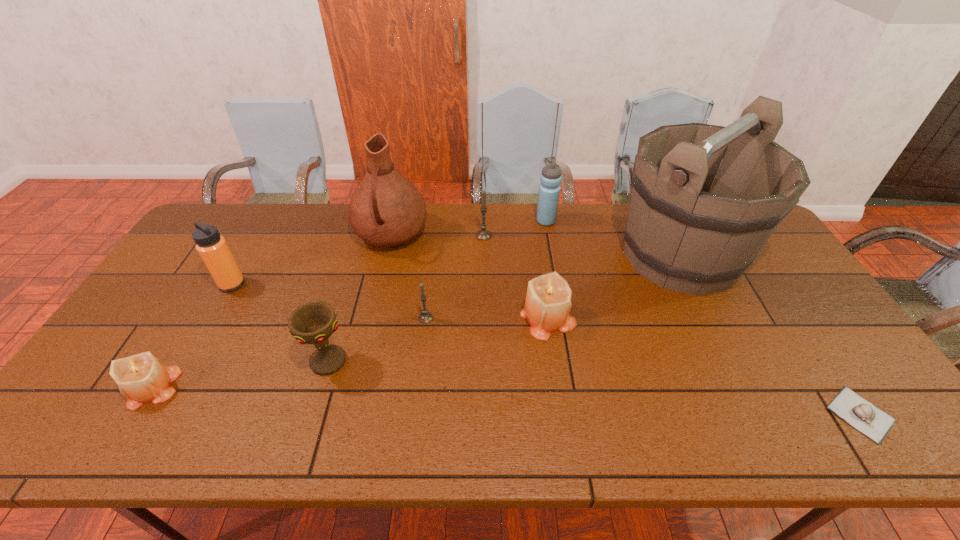
The image size is (960, 540). I want to click on the nearer gray candle, so click(425, 317).

You are a GUI agent. You are given a task and a screenshot of the screen. Output one action in this format:
    pyautogui.click(x=<x>, y=<y>)
    Task: Click on the left beige candle
    The height and width of the screenshot is (540, 960).
    Given the screenshot: What is the action you would take?
    pyautogui.click(x=142, y=378)

Image resolution: width=960 pixels, height=540 pixels. I want to click on the nearer beige candle, so click(x=142, y=378).

Find the location of a particular element. The image size is (960, 540). garlic is located at coordinates (867, 418).

This screenshot has height=540, width=960. I want to click on free space located on the front of the bucket, so click(x=731, y=356).

The width and height of the screenshot is (960, 540). I want to click on vacant space located 0.290m on the side of the second tallest object with the handle, so tap(369, 333).

Where is `vacant area located on the left of the water bottle`? vacant area located on the left of the water bottle is located at coordinates (511, 221).

This screenshot has height=540, width=960. Identify the location of blank space located 0.250m on the right of the thermos bottle. (327, 284).

Find the location of `blank area located 0.320m on the right of the sixth object from left to right`. blank area located 0.320m on the right of the sixth object from left to right is located at coordinates (587, 235).

I want to click on blank area located 0.220m on the back of the chalice, so click(x=351, y=285).